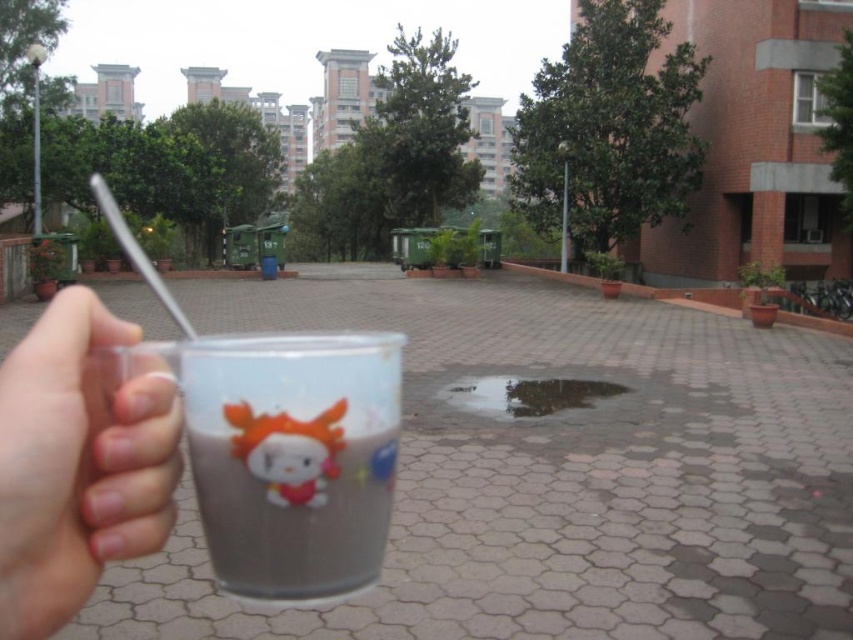
You are a delivery person holding a package and need to place it on a surface that can hold weight. You see the transparent plastic cup at lower left and the glossy concrete puddle at center. Which surface is suitable for placing the package?

The glossy concrete puddle at center is suitable for placing the package because it is a solid surface, while the transparent plastic cup at lower left is lightweight and not designed to hold heavy items.

You are standing in the courtyard and want to take a photo of both point (x=276, y=476) and point (x=320, y=436). Which point should you focus on first to ensure both are in clear view?

You should focus on point (x=276, y=476) first because it is closer to the camera than point (x=320, y=436), ensuring both are in focus when using depth of field.